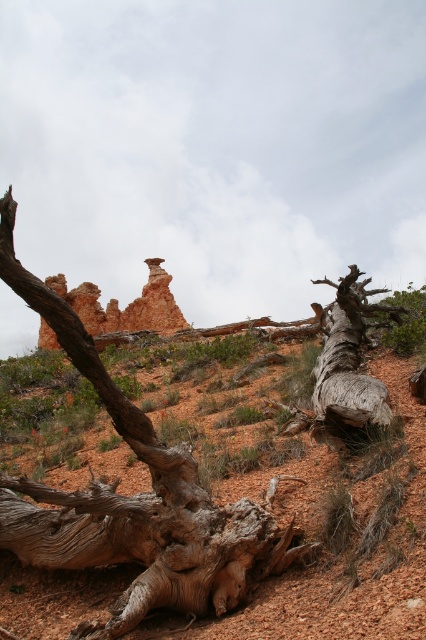
Is gray weathered log at lower right wider than rustic sandstone hoodoo at center?

In fact, gray weathered log at lower right might be narrower than rustic sandstone hoodoo at center.

Does gray weathered log at lower right appear on the right side of rustic sandstone hoodoo at center?

Indeed, gray weathered log at lower right is positioned on the right side of rustic sandstone hoodoo at center.

In order to click on gray weathered log at lower right in this screenshot , I will do `click(348, 365)`.

Identify the location of gray weathered log at lower right. This screenshot has width=426, height=640. (348, 365).

Is gray textured log at center wider than rustic sandstone hoodoo at center?

No, gray textured log at center is not wider than rustic sandstone hoodoo at center.

Between point (172, 458) and point (166, 273), which one is positioned behind?

The point (166, 273) is more distant.

The image size is (426, 640). Identify the location of gray textured log at center. (132, 500).

Between point (221, 609) and point (336, 404), which one is positioned behind?

The point (336, 404) is behind.

Is point (0, 476) farther from camera compared to point (325, 416)?

No, (0, 476) is closer to viewer.

Where is `gray textured log at center`? The height and width of the screenshot is (640, 426). gray textured log at center is located at coordinates (132, 500).